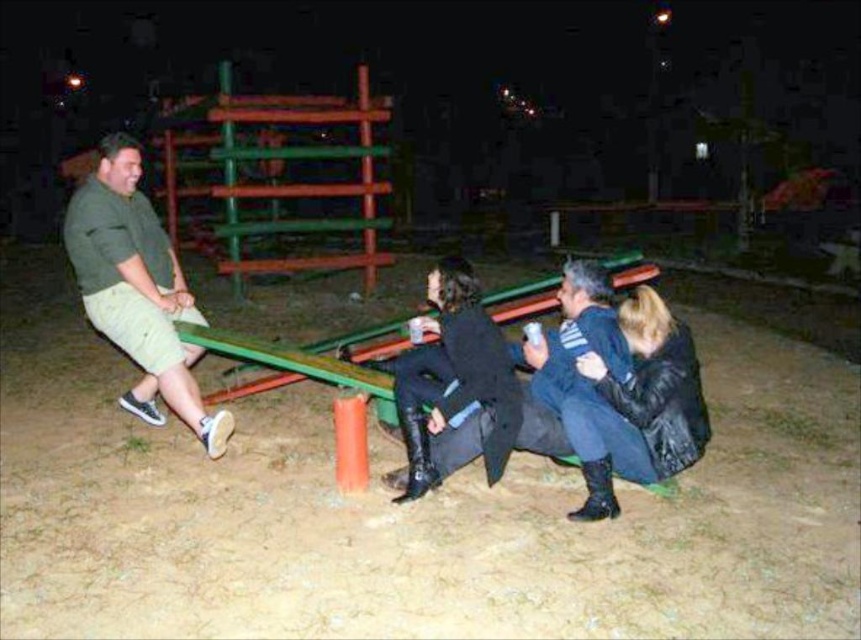
Question: Which object is positioned farthest from the green matte shorts at left?

Choices:
 (A) black leather jacket at lower right
 (B) black leather boots at center

Answer: (A)

Question: Can you confirm if black leather jacket at lower right is thinner than black leather boots at center?

Choices:
 (A) no
 (B) yes

Answer: (A)

Question: Considering the real-world distances, which object is farthest from the black leather jacket at lower right?

Choices:
 (A) green matte shorts at left
 (B) black leather boots at center

Answer: (A)

Question: Considering the relative positions of green matte shorts at left and black leather boots at center in the image provided, where is green matte shorts at left located with respect to black leather boots at center?

Choices:
 (A) below
 (B) above

Answer: (B)

Question: Estimate the real-world distances between objects in this image. Which object is farther from the black leather jacket at lower right?

Choices:
 (A) green matte shorts at left
 (B) black leather boots at center

Answer: (A)

Question: Can you confirm if green matte shorts at left is bigger than black leather jacket at lower right?

Choices:
 (A) no
 (B) yes

Answer: (B)